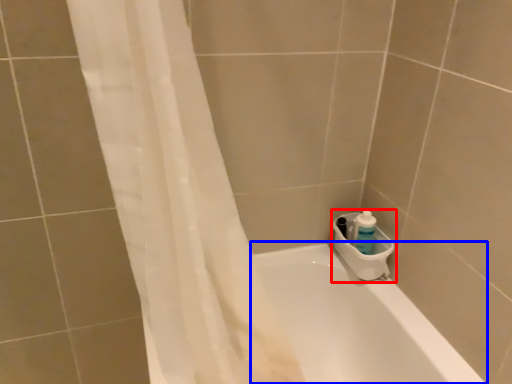
Question: Which of the following is the farthest to the observer, sink (highlighted by a red box) or bathtub (highlighted by a blue box)?

Choices:
 (A) sink
 (B) bathtub

Answer: (A)